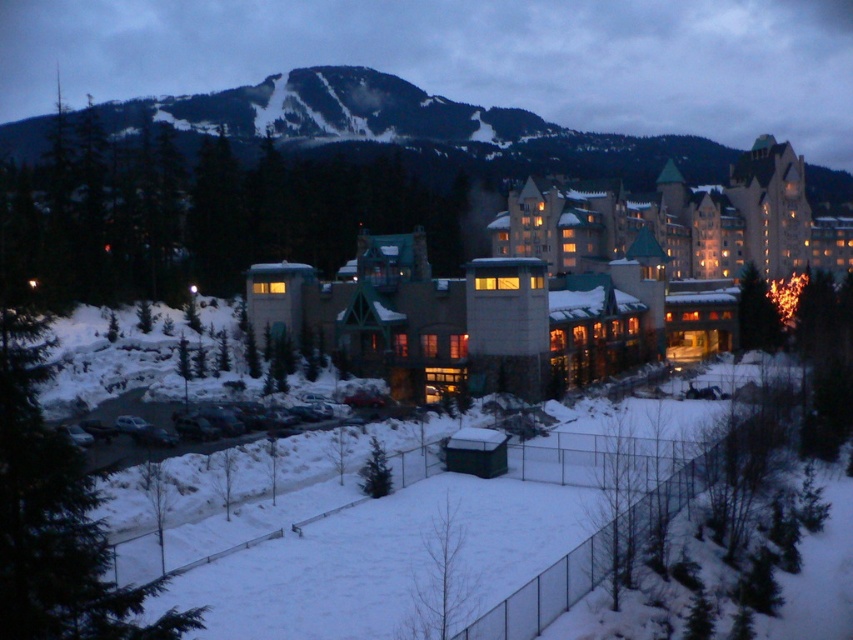
Question: Is matte stone building at center thinner than white snow at lower center?

Choices:
 (A) yes
 (B) no

Answer: (B)

Question: Among these objects, which one is nearest to the camera?

Choices:
 (A) matte stone building at center
 (B) snowy forested mountain at upper center

Answer: (A)

Question: Which of these objects is positioned farthest from the white snow at lower center?

Choices:
 (A) snowy forested mountain at upper center
 (B) matte stone building at center

Answer: (A)

Question: Can you confirm if snowy forested mountain at upper center is wider than white snow at lower center?

Choices:
 (A) yes
 (B) no

Answer: (A)

Question: Can you confirm if matte stone building at center is positioned below white snow at lower center?

Choices:
 (A) yes
 (B) no

Answer: (B)

Question: Which of the following is the closest to the observer?

Choices:
 (A) matte stone building at center
 (B) white snow at lower center
 (C) snowy forested mountain at upper center

Answer: (B)